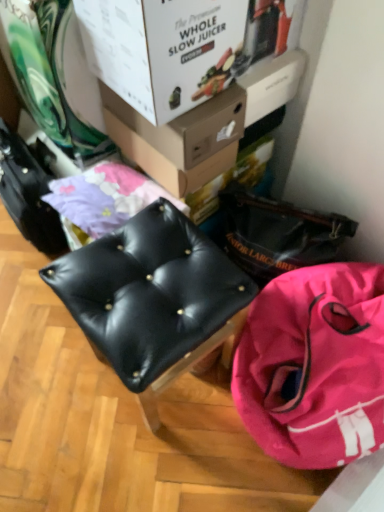
What is the approximate width of matte cardboard box at upper center, acting as the second box starting from the front?

It is 10.91 inches.

Image resolution: width=384 pixels, height=512 pixels. What do you see at coordinates (152, 298) in the screenshot?
I see `black leather stool at center` at bounding box center [152, 298].

This screenshot has height=512, width=384. I want to click on pink fabric bag at lower right, so click(x=314, y=366).

Is matte cardboard box at upper center, marked as the 1th box in a back-to-front arrangement, to the left of white cardboard box at upper center, placed as the 1th box when sorted from front to back, from the viewer's perspective?

No.

Considering the relative sizes of matte cardboard box at upper center, acting as the second box starting from the front, and white cardboard box at upper center, placed as the 1th box when sorted from front to back, in the image provided, is matte cardboard box at upper center, acting as the second box starting from the front, taller than white cardboard box at upper center, placed as the 1th box when sorted from front to back,?

Incorrect, the height of matte cardboard box at upper center, acting as the second box starting from the front, is not larger of that of white cardboard box at upper center, placed as the 1th box when sorted from front to back.

Based on the photo, is matte cardboard box at upper center, marked as the 1th box in a back-to-front arrangement, situated inside white cardboard box at upper center, placed as the 1th box when sorted from front to back, or outside?

matte cardboard box at upper center, marked as the 1th box in a back-to-front arrangement, lies outside white cardboard box at upper center, placed as the 1th box when sorted from front to back.

From the image's perspective, is matte cardboard box at upper center, acting as the second box starting from the front, positioned above or below white cardboard box at upper center, placed as the 1th box when sorted from front to back?

matte cardboard box at upper center, acting as the second box starting from the front, is below white cardboard box at upper center, placed as the 1th box when sorted from front to back.

Does pink fabric bag at lower right have a lesser width compared to black leather stool at center?

No.

Which object is further away from the camera, pink fabric bag at lower right or black leather stool at center?

pink fabric bag at lower right is further away from the camera.

Is pink fabric bag at lower right aimed at black leather stool at center?

No, pink fabric bag at lower right does not turn towards black leather stool at center.

From a real-world perspective, is pink fabric bag at lower right physically located above or below black leather stool at center?

pink fabric bag at lower right is situated lower than black leather stool at center in the real world.

From the image's perspective, starting from the black leather stool at center, which box is the 1st one above? Please provide its 2D coordinates.

[(179, 139)]

Which is behind, point (166, 239) or point (141, 135)?

The point (141, 135) is behind.

From a real-world perspective, between black leather stool at center and matte cardboard box at upper center, acting as the second box starting from the front, who is vertically higher?

matte cardboard box at upper center, acting as the second box starting from the front, is physically above.

Is black leather stool at center outside of matte cardboard box at upper center, acting as the second box starting from the front?

Yes, black leather stool at center is not within matte cardboard box at upper center, acting as the second box starting from the front.

Could you measure the distance between white cardboard box at upper center, placed as the 1th box when sorted from front to back, and pink fabric bag at lower right?

23.45 inches.

Is white cardboard box at upper center, placed as the 1th box when sorted from front to back, bigger or smaller than pink fabric bag at lower right?

In the image, white cardboard box at upper center, placed as the 1th box when sorted from front to back, appears to be smaller than pink fabric bag at lower right.

Consider the image. Which is nearer, (197, 39) or (361, 344)?

The point (197, 39) is closer to the camera.

Considering the relative sizes of white cardboard box at upper center, which is the second box from back to front, and pink fabric bag at lower right in the image provided, is white cardboard box at upper center, which is the second box from back to front, thinner than pink fabric bag at lower right?

Yes.

Considering the relative sizes of black leather stool at center and pink fabric bag at lower right in the image provided, is black leather stool at center taller than pink fabric bag at lower right?

Indeed, black leather stool at center has a greater height compared to pink fabric bag at lower right.

Is black leather stool at center looking in the opposite direction of pink fabric bag at lower right?

No.

Looking at the image, does black leather stool at center seem bigger or smaller compared to pink fabric bag at lower right?

Clearly, black leather stool at center is smaller in size than pink fabric bag at lower right.

Between black leather stool at center and pink fabric bag at lower right, which one is positioned in front?

black leather stool at center is in front.

Considering the relative positions of black leather stool at center and white cardboard box at upper center, which is the second box from back to front, in the image provided, is black leather stool at center in front of white cardboard box at upper center, which is the second box from back to front,?

Yes, black leather stool at center is closer to the camera.

Is black leather stool at center bigger than white cardboard box at upper center, which is the second box from back to front?

Correct, black leather stool at center is larger in size than white cardboard box at upper center, which is the second box from back to front.

Does black leather stool at center have a greater height compared to white cardboard box at upper center, placed as the 1th box when sorted from front to back?

Correct, black leather stool at center is much taller as white cardboard box at upper center, placed as the 1th box when sorted from front to back.

How different are the orientations of black leather stool at center and white cardboard box at upper center, which is the second box from back to front, in degrees?

The facing directions of black leather stool at center and white cardboard box at upper center, which is the second box from back to front, are 1.64 degrees apart.

Locate an element on the screen. The image size is (384, 512). the 2nd box behind the pink fabric bag at lower right is located at coordinates (179, 139).

Which of these two, matte cardboard box at upper center, marked as the 1th box in a back-to-front arrangement, or pink fabric bag at lower right, stands taller?

With more height is pink fabric bag at lower right.

Is matte cardboard box at upper center, marked as the 1th box in a back-to-front arrangement, located outside pink fabric bag at lower right?

That's correct, matte cardboard box at upper center, marked as the 1th box in a back-to-front arrangement, is outside of pink fabric bag at lower right.

At what (x,y) coordinates should I click in order to perform the action: click on box that is in front of the matte cardboard box at upper center, marked as the 1th box in a back-to-front arrangement. Please return your answer as a coordinate pair (x, y). This screenshot has height=512, width=384. Looking at the image, I should click on (190, 52).

At what (x,y) coordinates should I click in order to perform the action: click on handbag lying behind the black leather stool at center. Please return your answer as a coordinate pair (x, y). Looking at the image, I should click on (314, 366).

Which object lies nearer to the anchor point pink fabric bag at lower right, white cardboard box at upper center, which is the second box from back to front, or matte cardboard box at upper center, marked as the 1th box in a back-to-front arrangement?

Based on the image, matte cardboard box at upper center, marked as the 1th box in a back-to-front arrangement, appears to be nearer to pink fabric bag at lower right.

Considering their positions, is pink fabric bag at lower right positioned further to white cardboard box at upper center, which is the second box from back to front, than matte cardboard box at upper center, acting as the second box starting from the front?

pink fabric bag at lower right is positioned further to the anchor white cardboard box at upper center, which is the second box from back to front.

Based on their spatial positions, is black leather stool at center or white cardboard box at upper center, which is the second box from back to front, further from matte cardboard box at upper center, acting as the second box starting from the front?

black leather stool at center.

Estimate the real-world distances between objects in this image. Which object is closer to black leather stool at center, white cardboard box at upper center, placed as the 1th box when sorted from front to back, or pink fabric bag at lower right?

pink fabric bag at lower right is closer to black leather stool at center.

Looking at the image, which one is located closer to pink fabric bag at lower right, black leather stool at center or white cardboard box at upper center, which is the second box from back to front?

black leather stool at center is closer to pink fabric bag at lower right.

Looking at the image, which one is located closer to matte cardboard box at upper center, marked as the 1th box in a back-to-front arrangement, pink fabric bag at lower right or white cardboard box at upper center, which is the second box from back to front?

white cardboard box at upper center, which is the second box from back to front.

Which object lies nearer to the anchor point matte cardboard box at upper center, marked as the 1th box in a back-to-front arrangement, white cardboard box at upper center, placed as the 1th box when sorted from front to back, or pink fabric bag at lower right?

The object closer to matte cardboard box at upper center, marked as the 1th box in a back-to-front arrangement, is white cardboard box at upper center, placed as the 1th box when sorted from front to back.

Estimate the real-world distances between objects in this image. Which object is closer to white cardboard box at upper center, which is the second box from back to front, black leather stool at center or pink fabric bag at lower right?

black leather stool at center.

Find the location of `box between white cardboard box at upper center, placed as the 1th box when sorted from front to back, and black leather stool at center vertically`. box between white cardboard box at upper center, placed as the 1th box when sorted from front to back, and black leather stool at center vertically is located at coordinates tap(179, 139).

The height and width of the screenshot is (512, 384). I want to click on box that lies between white cardboard box at upper center, placed as the 1th box when sorted from front to back, and pink fabric bag at lower right from top to bottom, so click(179, 139).

In order to click on furniture between matte cardboard box at upper center, marked as the 1th box in a back-to-front arrangement, and pink fabric bag at lower right from top to bottom in this screenshot , I will do `click(152, 298)`.

Locate an element on the screen. The height and width of the screenshot is (512, 384). furniture between white cardboard box at upper center, placed as the 1th box when sorted from front to back, and pink fabric bag at lower right from top to bottom is located at coordinates (152, 298).